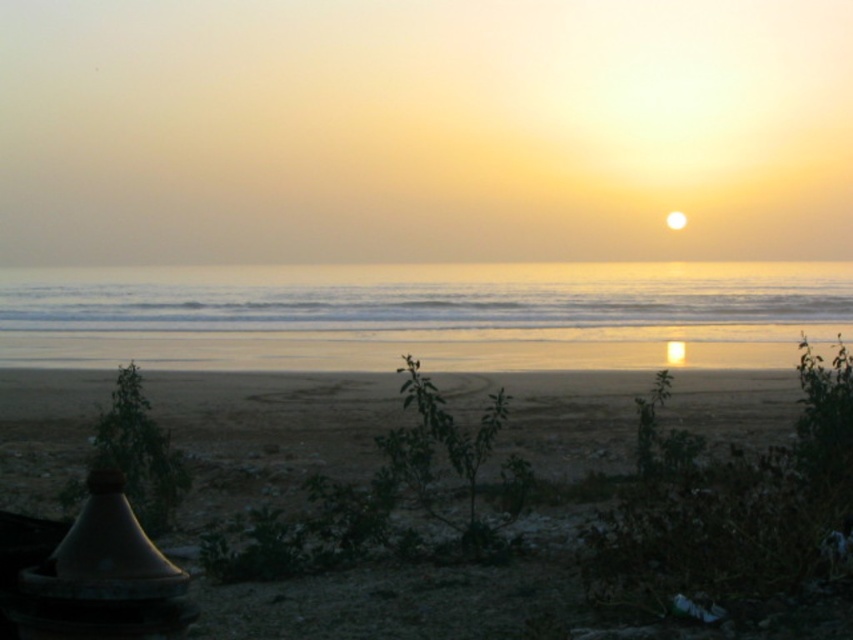
Question: Is sandy beach at lower center to the left of silvery reflective water at center from the viewer's perspective?

Choices:
 (A) no
 (B) yes

Answer: (A)

Question: Does sandy beach at lower center lie behind silvery reflective water at center?

Choices:
 (A) no
 (B) yes

Answer: (A)

Question: Can you confirm if sandy beach at lower center is bigger than silvery reflective water at center?

Choices:
 (A) yes
 (B) no

Answer: (B)

Question: Among these objects, which one is farthest from the camera?

Choices:
 (A) silvery reflective water at center
 (B) sandy beach at lower center

Answer: (A)